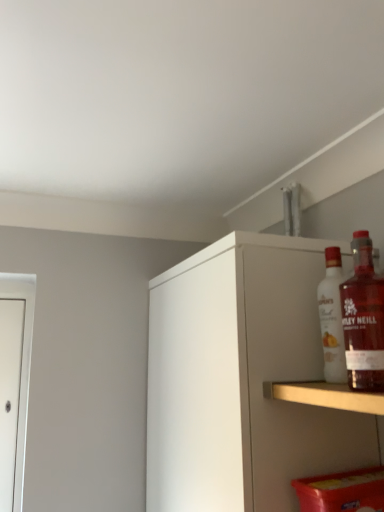
Describe the element at coordinates (363, 319) in the screenshot. I see `translucent glass bottle at upper right, which ranks as the 2th bottle in back-to-front order` at that location.

Locate an element on the screen. The image size is (384, 512). translucent glass bottle at upper right, the 1th bottle viewed from the front is located at coordinates (363, 319).

The width and height of the screenshot is (384, 512). Identify the location of white matte cabinet at upper right. (241, 379).

How many degrees apart are the facing directions of white glass bottle at upper right, which appears as the second bottle when viewed from the front, and translucent glass bottle at upper right, the 1th bottle viewed from the front?

The facing directions of white glass bottle at upper right, which appears as the second bottle when viewed from the front, and translucent glass bottle at upper right, the 1th bottle viewed from the front, are 0.894 degrees apart.

Can you confirm if white glass bottle at upper right, which appears as the second bottle when viewed from the front, is shorter than translucent glass bottle at upper right, which ranks as the 2th bottle in back-to-front order?

No.

From a real-world perspective, does white glass bottle at upper right, which appears as the second bottle when viewed from the front, stand above translucent glass bottle at upper right, which ranks as the 2th bottle in back-to-front order?

Yes.

Looking at this image, between white glass bottle at upper right, the first bottle when ordered from back to front, and translucent glass bottle at upper right, which ranks as the 2th bottle in back-to-front order, which one appears on the right side from the viewer's perspective?

white glass bottle at upper right, the first bottle when ordered from back to front, is more to the right.

Looking at this image, from a real-world perspective, between translucent glass bottle at upper right, which ranks as the 2th bottle in back-to-front order, and white matte cabinet at upper right, who is vertically lower?

white matte cabinet at upper right.

Which is in front, point (345, 321) or point (226, 410)?

The point (345, 321) is more forward.

Is translucent glass bottle at upper right, which ranks as the 2th bottle in back-to-front order, inside or outside of white matte cabinet at upper right?

translucent glass bottle at upper right, which ranks as the 2th bottle in back-to-front order, is not enclosed by white matte cabinet at upper right.

Which object is wider, translucent glass bottle at upper right, the 1th bottle viewed from the front, or white matte cabinet at upper right?

white matte cabinet at upper right.

Does white matte cabinet at upper right have a larger size compared to translucent glass bottle at upper right, the 1th bottle viewed from the front?

Yes.

Is white matte cabinet at upper right positioned beyond the bounds of translucent glass bottle at upper right, the 1th bottle viewed from the front?

Indeed, white matte cabinet at upper right is completely outside translucent glass bottle at upper right, the 1th bottle viewed from the front.

Is white matte cabinet at upper right taller than translucent glass bottle at upper right, which ranks as the 2th bottle in back-to-front order?

Correct, white matte cabinet at upper right is much taller as translucent glass bottle at upper right, which ranks as the 2th bottle in back-to-front order.

Is white matte cabinet at upper right facing towards translucent glass bottle at upper right, which ranks as the 2th bottle in back-to-front order?

No.

Which of these two, white matte cabinet at upper right or white glass bottle at upper right, which appears as the second bottle when viewed from the front, stands taller?

With more height is white matte cabinet at upper right.

Is white matte cabinet at upper right positioned with its back to white glass bottle at upper right, which appears as the second bottle when viewed from the front?

No.

From the image's perspective, who appears lower, white matte cabinet at upper right or white glass bottle at upper right, which appears as the second bottle when viewed from the front?

white matte cabinet at upper right, from the image's perspective.

Is point (223, 412) positioned before point (330, 338)?

No, it is not.

Is translucent glass bottle at upper right, the 1th bottle viewed from the front, situated inside white glass bottle at upper right, which appears as the second bottle when viewed from the front, or outside?

translucent glass bottle at upper right, the 1th bottle viewed from the front, is outside white glass bottle at upper right, which appears as the second bottle when viewed from the front.

Considering the positions of objects translucent glass bottle at upper right, the 1th bottle viewed from the front, and white glass bottle at upper right, the first bottle when ordered from back to front, in the image provided, who is more to the right, translucent glass bottle at upper right, the 1th bottle viewed from the front, or white glass bottle at upper right, the first bottle when ordered from back to front,?

From the viewer's perspective, white glass bottle at upper right, the first bottle when ordered from back to front, appears more on the right side.

Based on their sizes in the image, would you say translucent glass bottle at upper right, the 1th bottle viewed from the front, is bigger or smaller than white glass bottle at upper right, the first bottle when ordered from back to front?

Considering their sizes, translucent glass bottle at upper right, the 1th bottle viewed from the front, takes up more space than white glass bottle at upper right, the first bottle when ordered from back to front.

Measure the distance from translucent glass bottle at upper right, the 1th bottle viewed from the front, to white glass bottle at upper right, which appears as the second bottle when viewed from the front.

translucent glass bottle at upper right, the 1th bottle viewed from the front, is 3.69 inches from white glass bottle at upper right, which appears as the second bottle when viewed from the front.

From a real-world perspective, which is physically above, white glass bottle at upper right, the first bottle when ordered from back to front, or white matte cabinet at upper right?

white glass bottle at upper right, the first bottle when ordered from back to front.

Is white glass bottle at upper right, which appears as the second bottle when viewed from the front, turned away from white matte cabinet at upper right?

No, white matte cabinet at upper right is not at the back of white glass bottle at upper right, which appears as the second bottle when viewed from the front.

From the image's perspective, is white glass bottle at upper right, which appears as the second bottle when viewed from the front, under white matte cabinet at upper right?

No.

At what (x,y) coordinates should I click in order to perform the action: click on cabinetry below the white glass bottle at upper right, which appears as the second bottle when viewed from the front (from the image's perspective). Please return your answer as a coordinate pair (x, y). This screenshot has width=384, height=512. Looking at the image, I should click on (241, 379).

The width and height of the screenshot is (384, 512). In order to click on bottle on the right of translucent glass bottle at upper right, which ranks as the 2th bottle in back-to-front order in this screenshot , I will do click(x=332, y=318).

Locate an element on the screen. This screenshot has height=512, width=384. the 2nd bottle above the white matte cabinet at upper right (from the image's perspective) is located at coordinates tap(363, 319).

Which object lies further to the anchor point white matte cabinet at upper right, translucent glass bottle at upper right, the 1th bottle viewed from the front, or white glass bottle at upper right, the first bottle when ordered from back to front?

translucent glass bottle at upper right, the 1th bottle viewed from the front, lies further to white matte cabinet at upper right than the other object.

From the image, which object appears to be farther from white glass bottle at upper right, the first bottle when ordered from back to front, translucent glass bottle at upper right, the 1th bottle viewed from the front, or white matte cabinet at upper right?

white matte cabinet at upper right is further to white glass bottle at upper right, the first bottle when ordered from back to front.

When comparing their distances from translucent glass bottle at upper right, the 1th bottle viewed from the front, does white matte cabinet at upper right or white glass bottle at upper right, the first bottle when ordered from back to front, seem further?

The object further to translucent glass bottle at upper right, the 1th bottle viewed from the front, is white matte cabinet at upper right.

From the image, which object appears to be nearer to white matte cabinet at upper right, white glass bottle at upper right, the first bottle when ordered from back to front, or translucent glass bottle at upper right, which ranks as the 2th bottle in back-to-front order?

white glass bottle at upper right, the first bottle when ordered from back to front.

From the image, which object appears to be farther from white glass bottle at upper right, the first bottle when ordered from back to front, white matte cabinet at upper right or translucent glass bottle at upper right, which ranks as the 2th bottle in back-to-front order?

Among the two, white matte cabinet at upper right is located further to white glass bottle at upper right, the first bottle when ordered from back to front.

Based on their spatial positions, is white glass bottle at upper right, which appears as the second bottle when viewed from the front, or white matte cabinet at upper right closer to translucent glass bottle at upper right, the 1th bottle viewed from the front?

white glass bottle at upper right, which appears as the second bottle when viewed from the front, is positioned closer to the anchor translucent glass bottle at upper right, the 1th bottle viewed from the front.

Identify the location of bottle between translucent glass bottle at upper right, which ranks as the 2th bottle in back-to-front order, and white matte cabinet at upper right from top to bottom. Image resolution: width=384 pixels, height=512 pixels. (332, 318).